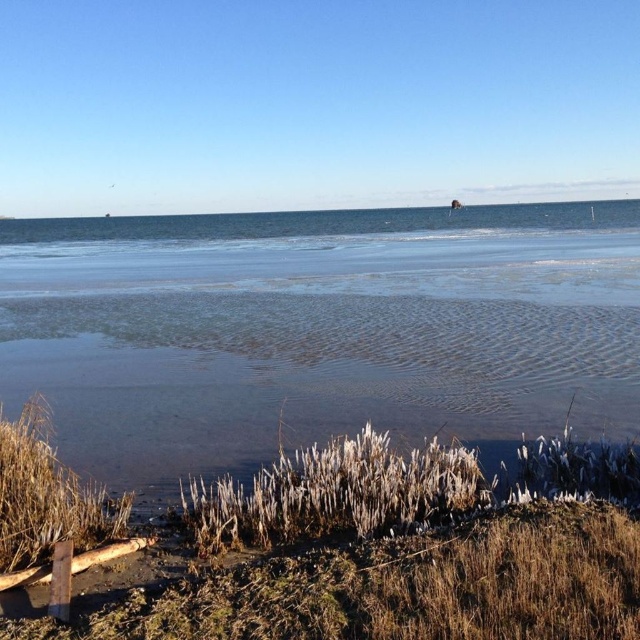
Question: Which of the following is the farthest from the observer?

Choices:
 (A) (333, 508)
 (B) (612, 420)

Answer: (B)

Question: Which point appears closest to the camera in this image?

Choices:
 (A) (49, 346)
 (B) (378, 522)

Answer: (B)

Question: Is clear water at lower center thinner than brown grass at lower center?

Choices:
 (A) no
 (B) yes

Answer: (A)

Question: Does clear water at lower center come behind brown grass at lower center?

Choices:
 (A) yes
 (B) no

Answer: (A)

Question: Is the position of clear water at lower center less distant than that of brown grass at lower center?

Choices:
 (A) yes
 (B) no

Answer: (B)

Question: Which point is farther to the camera?

Choices:
 (A) (548, 227)
 (B) (476, 456)

Answer: (A)